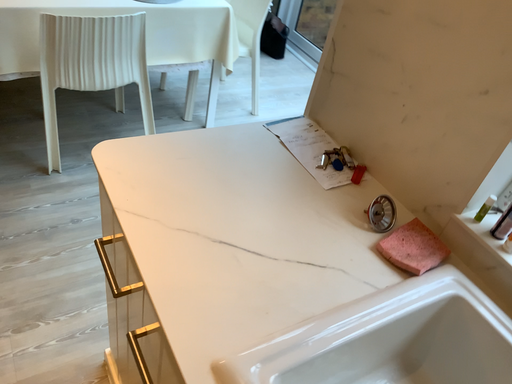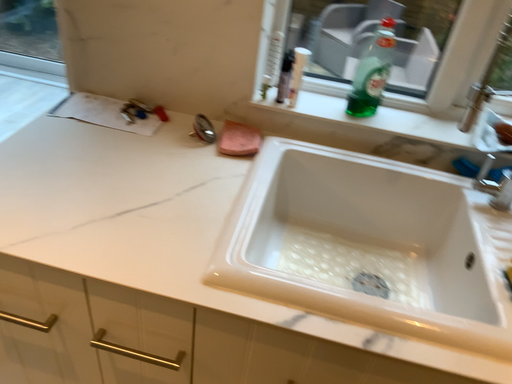
Question: How did the camera likely rotate when shooting the video?

Choices:
 (A) rotated downward
 (B) rotated upward

Answer: (B)